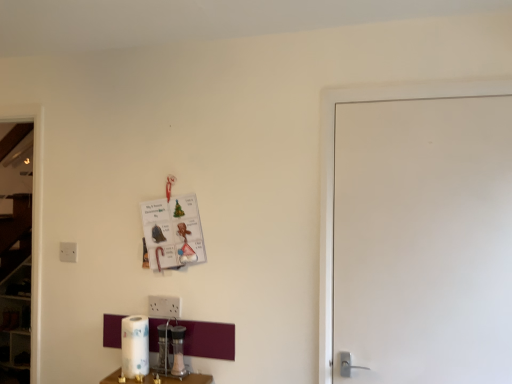
Locate an element on the screen. The height and width of the screenshot is (384, 512). empty space that is ontop of white matte door at right is located at coordinates (425, 97).